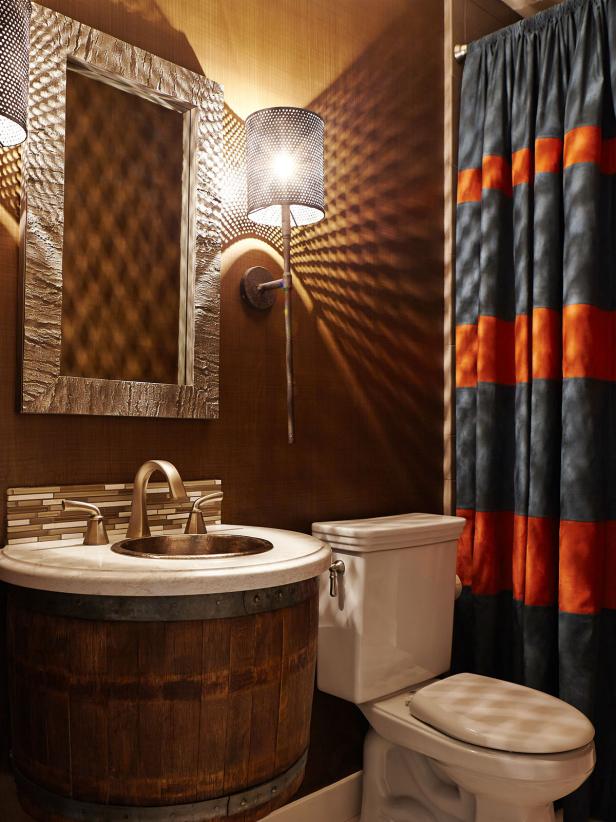
The width and height of the screenshot is (616, 822). In order to click on toilet handle in this screenshot , I will do `click(345, 576)`.